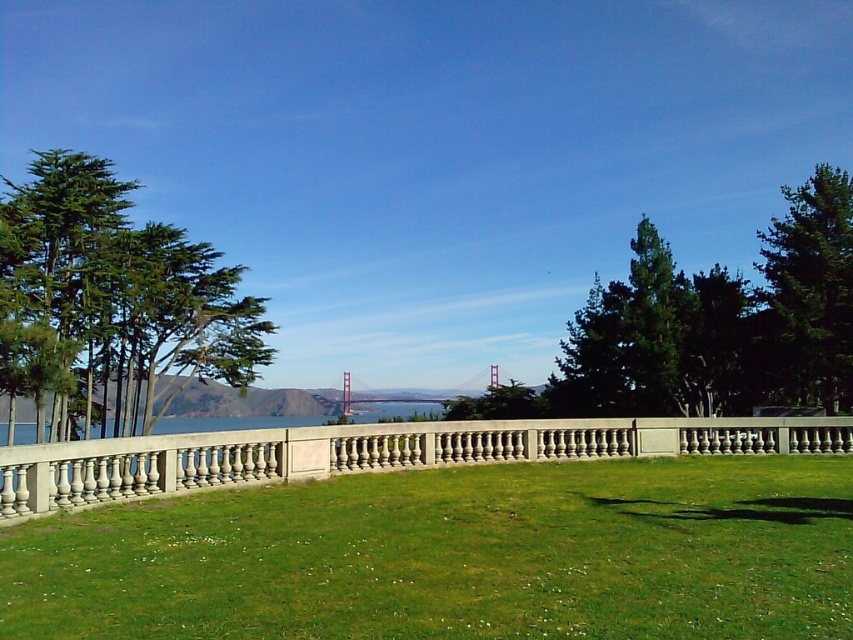
You are a photographer standing at the viewpoint overlooking San Francisco Bay. You notice two points marked in the scene. The first point is at coordinates point [61,337], and the second point is at coordinates point [801,280]. Which point is closer to your camera?

The point at coordinates point [61,337] is closer to the camera because it is further to the camera than point [801,280].